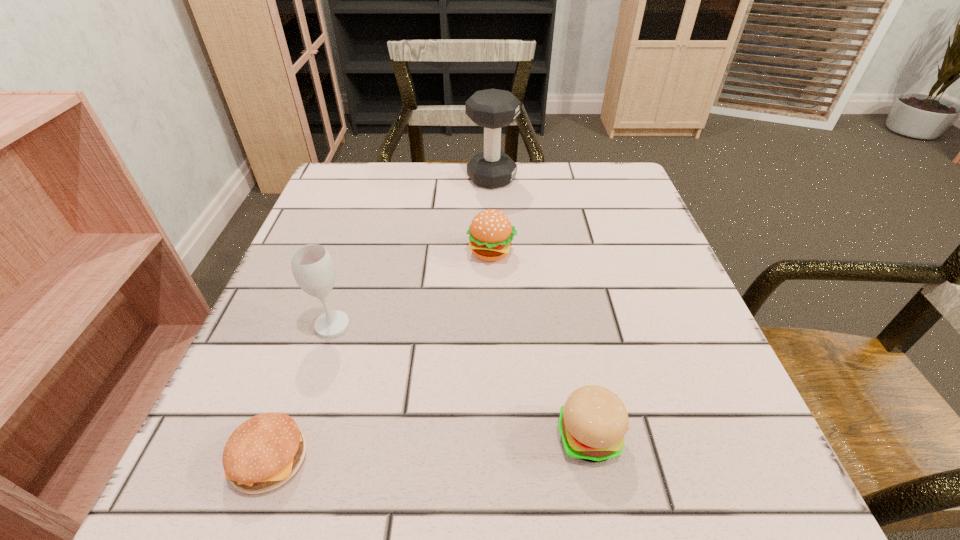
Locate an element on the screen. dumbbell is located at coordinates [x=492, y=109].

Find the location of a particular element. the farthest object is located at coordinates (492, 109).

Locate an element on the screen. The height and width of the screenshot is (540, 960). the second tallest object is located at coordinates (313, 269).

Image resolution: width=960 pixels, height=540 pixels. I want to click on wineglass, so click(313, 269).

Image resolution: width=960 pixels, height=540 pixels. I want to click on the tallest hamburger, so click(x=490, y=233).

The height and width of the screenshot is (540, 960). In order to click on the farthest hamburger in this screenshot , I will do `click(490, 233)`.

At what (x,y) coordinates should I click in order to perform the action: click on the rightmost hamburger. Please return your answer as a coordinate pair (x, y). The image size is (960, 540). Looking at the image, I should click on (592, 424).

Identify the location of the second shortest object. (592, 424).

Locate an element on the screen. The width and height of the screenshot is (960, 540). the leftmost hamburger is located at coordinates (265, 451).

Locate an element on the screen. the shortest hamburger is located at coordinates (265, 451).